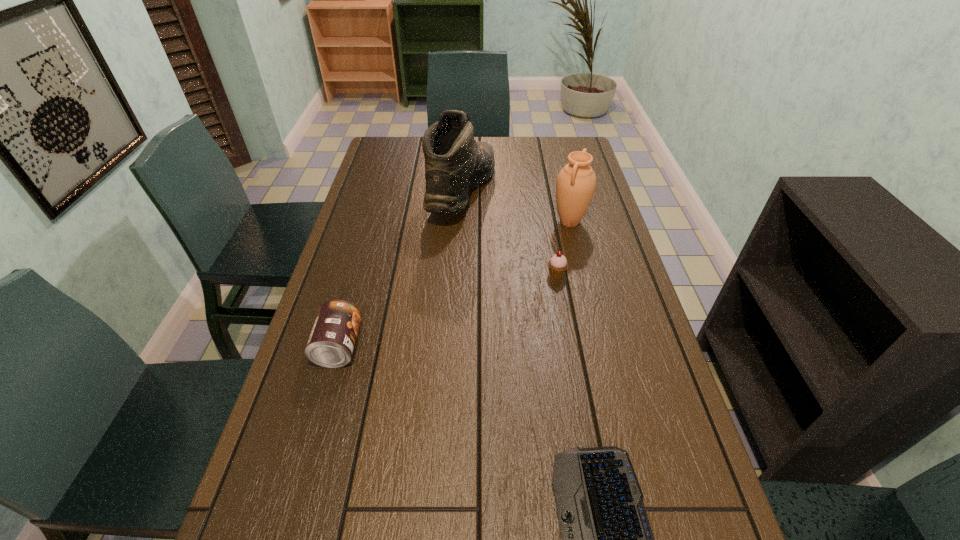
Identify the location of vacant region located 0.060m on the right of the third farthest object. This screenshot has height=540, width=960. (587, 274).

Where is `object that is at the far edge`? object that is at the far edge is located at coordinates (454, 162).

I want to click on object situated at the left edge, so click(332, 339).

Find the location of a particular element. object that is at the right edge is located at coordinates [576, 182].

Find the location of a particular element. This screenshot has height=540, width=960. free space at the far edge of the desktop is located at coordinates (544, 159).

In the image, there is a desktop. Identify the location of vacant space at the left edge. This screenshot has height=540, width=960. (305, 485).

Where is `vacant space at the right edge of the desktop`? This screenshot has width=960, height=540. vacant space at the right edge of the desktop is located at coordinates (642, 357).

In the image, there is a desktop. Identify the location of vacant region at the far left corner. (395, 164).

This screenshot has width=960, height=540. In the image, there is a desktop. Find the location of `vacant space at the far right corner`. vacant space at the far right corner is located at coordinates (566, 162).

Locate an element on the screen. This screenshot has height=540, width=960. unoccupied position between the cupcake and the fourth object from right to left is located at coordinates (510, 233).